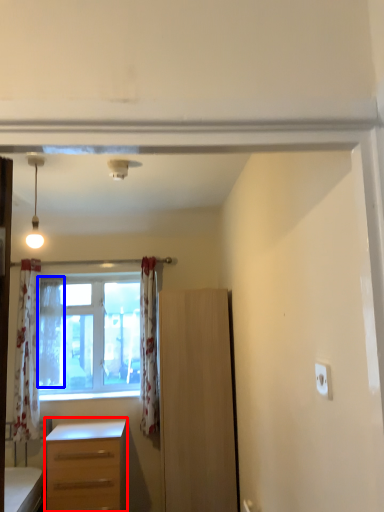
Question: Which object appears closest to the camera in this image, desk (highlighted by a red box) or curtain (highlighted by a blue box)?

Choices:
 (A) desk
 (B) curtain

Answer: (A)